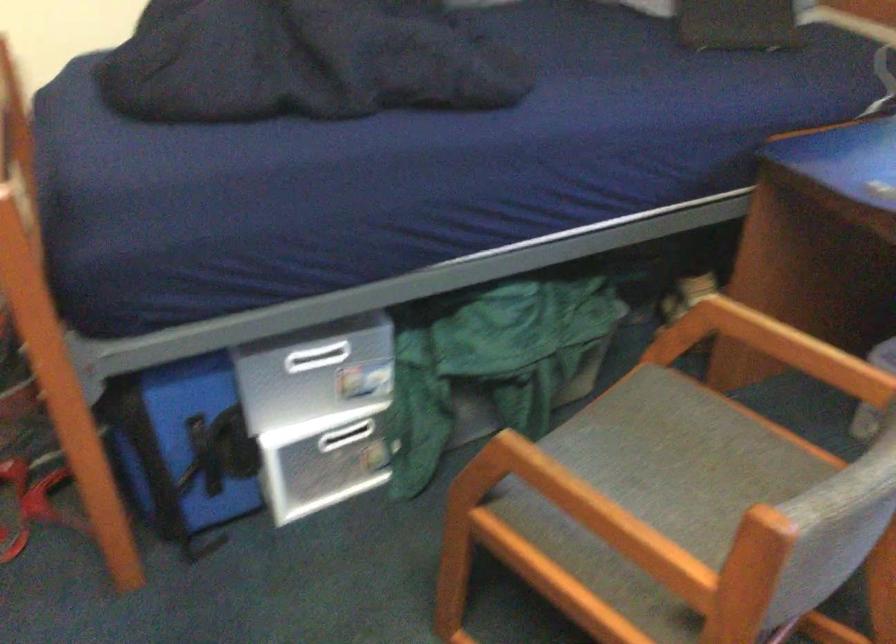
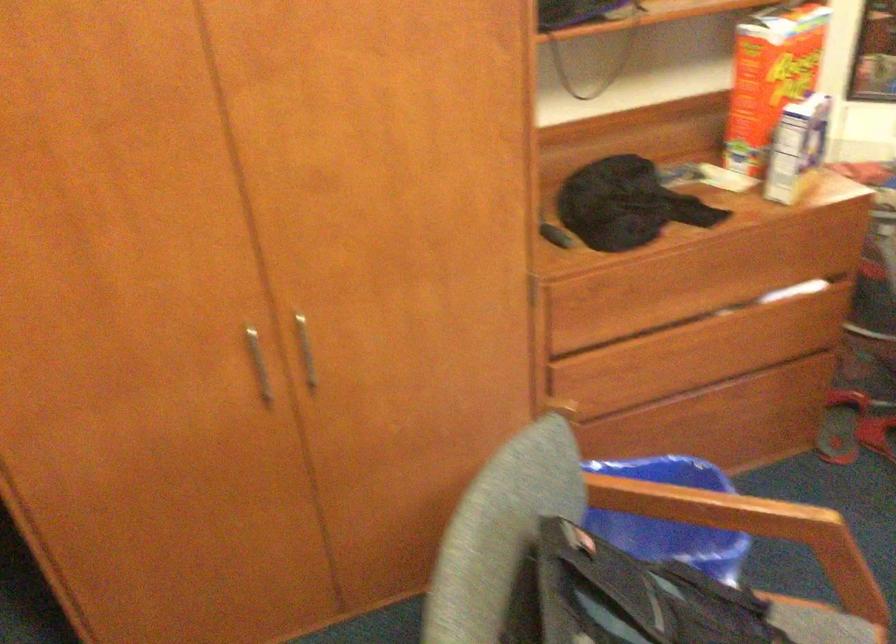
Question: The camera is either moving clockwise (left) or counter-clockwise (right) around the object. The first image is from the beginning of the video and the second image is from the end. Is the camera moving left or right when shooting the video?

Choices:
 (A) Left
 (B) Right

Answer: (B)